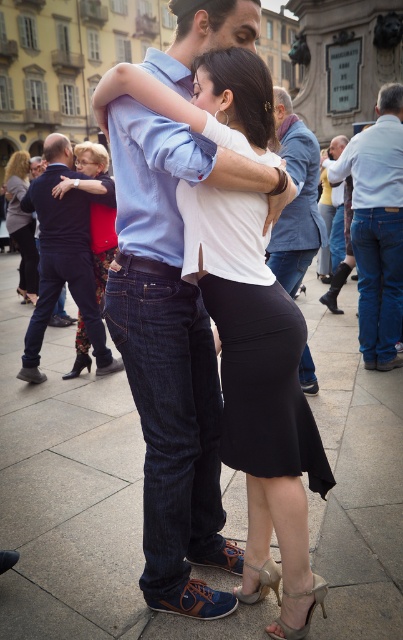
Question: Which object appears closest to the camera in this image?

Choices:
 (A) matte black dress at lower left
 (B) matte blue jeans at center
 (C) dark blue suit at center
 (D) black satin dress at center

Answer: (D)

Question: Which point is farther to the camera?

Choices:
 (A) (371, 205)
 (B) (20, 186)

Answer: (B)

Question: Can you confirm if jeans at right is positioned to the right of matte black dress at lower left?

Choices:
 (A) no
 (B) yes

Answer: (B)

Question: Does matte blue jeans at center come in front of matte black dress at lower left?

Choices:
 (A) no
 (B) yes

Answer: (B)

Question: Which point is closer to the camera taking this photo?

Choices:
 (A) tap(78, 243)
 (B) tap(35, 298)

Answer: (A)

Question: Can you confirm if black satin dress at center is positioned below denim jeans at center?

Choices:
 (A) yes
 (B) no

Answer: (A)